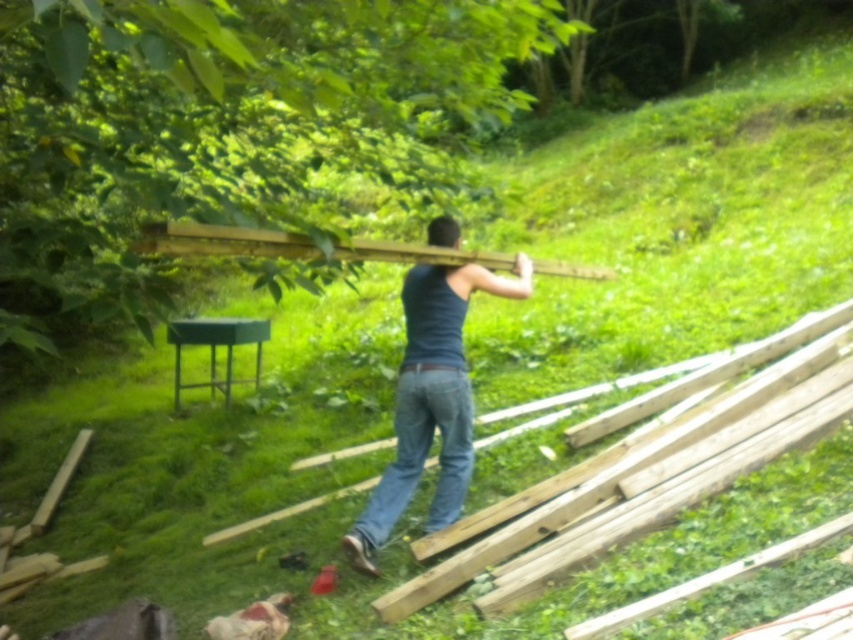
You are trying to decide whether to place a small potted plant on the dark blue tank top at center or the natural wood at right. Which surface is larger and can accommodate the plant better?

The natural wood at right is bigger than the dark blue tank top at center, so it can accommodate the plant better.

You are standing at the center of the grassy area and need to place a new wooden plank exactly where the natural wood at right is currently located. According to the scene, where should you position the new plank relative to the small dark green metal table or stand?

The natural wood at right is located at point (x=647, y=468), which is to the right of the small dark green metal table or stand. Position the new plank to the right of the table.

You are trying to determine if the dark blue tank top at center can be fully covered by the wooden plank at upper center when placed over it. Based on their widths, is this possible?

The dark blue tank top at center has a lesser width compared to the wooden plank at upper center, so the wooden plank at upper center can fully cover the dark blue tank top at center since it is wider.